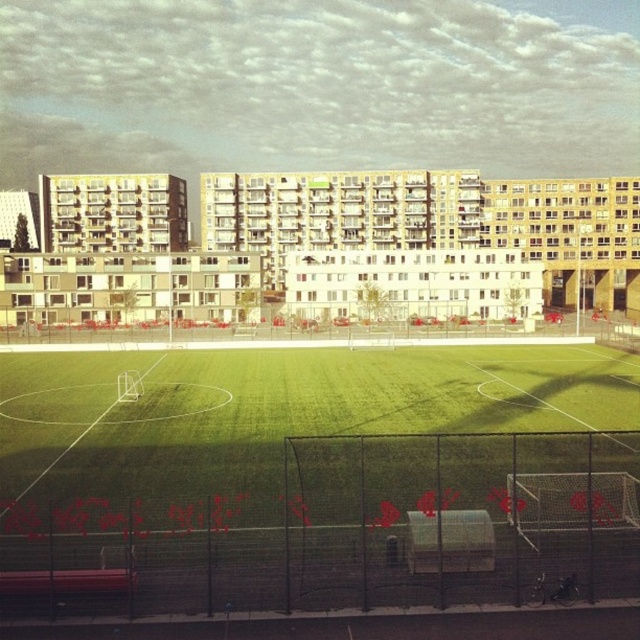
You are planning to organize a soccer match and need to choose between the green artificial turf at center and the green grass field at center. Based on their sizes, which one would be more suitable for a standard soccer field?

The green grass field at center is more suitable for a standard soccer field since it has a larger size compared to the green artificial turf at center.

You are a groundskeeper trying to determine the layout of the soccer field. You see the green artificial turf at center and the green grass field at center. Which one is located to the right side of the other?

The green artificial turf at center is positioned on the right side of the green grass field at center.